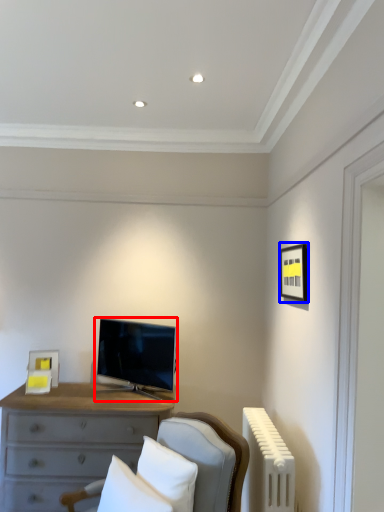
Question: Among these objects, which one is nearest to the camera, television (highlighted by a red box) or picture frame (highlighted by a blue box)?

Choices:
 (A) television
 (B) picture frame

Answer: (B)